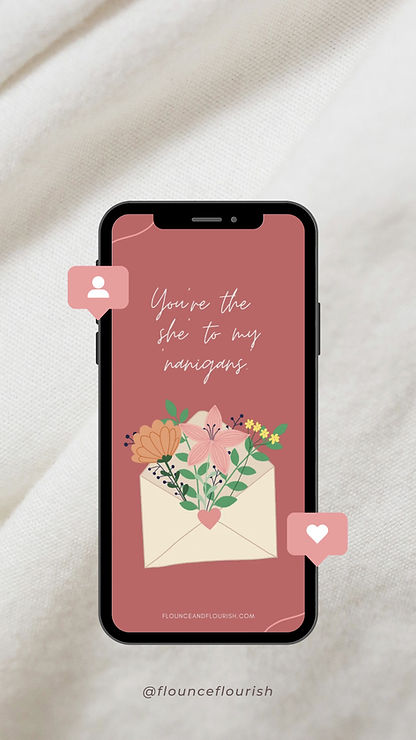
Where is `handle`? This screenshot has height=740, width=416. handle is located at coordinates (181, 692).